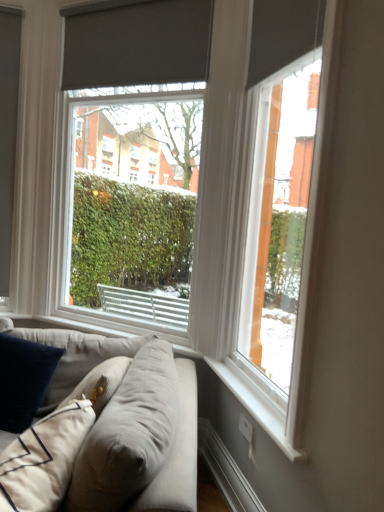
Question: Is point (6, 406) closer or farther from the camera than point (180, 142)?

Choices:
 (A) farther
 (B) closer

Answer: (B)

Question: Do you think velvety dark blue pillow at lower left is within matte gray roller blind at center, the 2th window viewed from the right, or outside of it?

Choices:
 (A) inside
 (B) outside

Answer: (B)

Question: Estimate the real-world distances between objects in this image. Which object is closer to the velvety dark blue pillow at lower left?

Choices:
 (A) matte gray roller blind at center, the 2th window viewed from the right
 (B) light gray fabric couch at lower left
 (C) matte gray roller blind at right, marked as the first window in a right-to-left arrangement
 (D) white painted wood at lower right

Answer: (B)

Question: Estimate the real-world distances between objects in this image. Which object is farther from the matte gray roller blind at center, the 2th window viewed from the right?

Choices:
 (A) matte gray roller blind at right, marked as the 1th window in a front-to-back arrangement
 (B) white painted wood at lower right
 (C) velvety dark blue pillow at lower left
 (D) light gray fabric couch at lower left

Answer: (B)